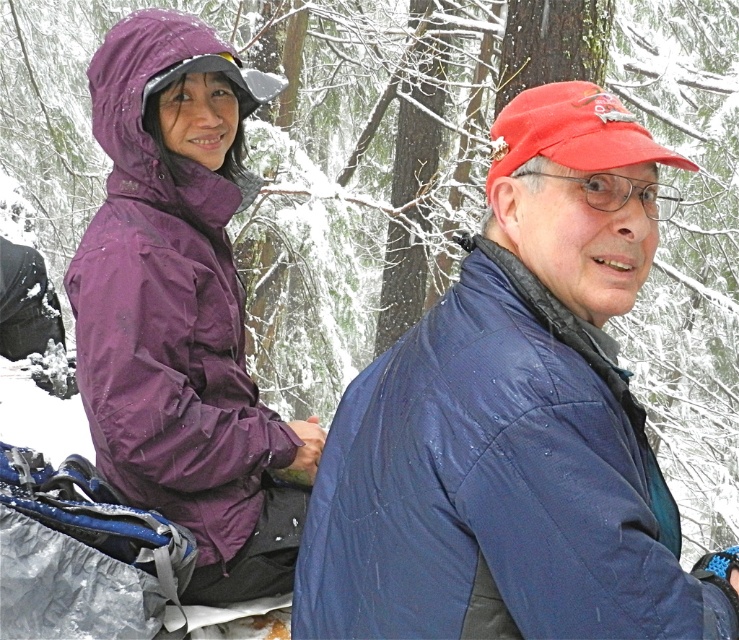
You are planning to take a winter hike and need to decide which jacket to wear based on the image. The blue quilted jacket at right is shorter than the purple waterproof jacket at left. Which jacket would provide better coverage against the snow and cold?

The purple waterproof jacket at left is taller than the blue quilted jacket at right, so it would provide better coverage against the snow and cold due to its longer length.